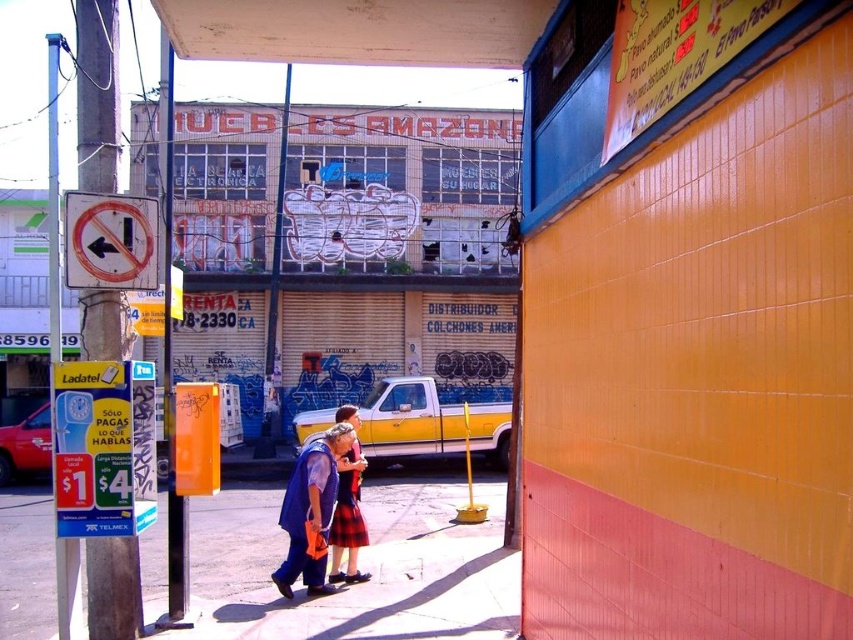
Question: Is orange plastic signpost at left positioned behind plaid fabric skirt at center?

Choices:
 (A) yes
 (B) no

Answer: (B)

Question: Which point appears closest to the camera in this image?

Choices:
 (A) (236, 532)
 (B) (297, 492)
 (C) (109, 298)

Answer: (C)

Question: Which point appears closest to the camera in this image?

Choices:
 (A) tap(107, 541)
 (B) tap(332, 426)

Answer: (A)

Question: Does smooth concrete sidewalk at center appear on the right side of plaid fabric skirt at center?

Choices:
 (A) yes
 (B) no

Answer: (B)

Question: Can you confirm if smooth concrete sidewalk at center is positioned above plaid fabric skirt at center?

Choices:
 (A) yes
 (B) no

Answer: (B)

Question: Considering the real-world distances, which object is farthest from the smooth concrete sidewalk at center?

Choices:
 (A) orange plastic signpost at left
 (B) plaid fabric skirt at center

Answer: (A)